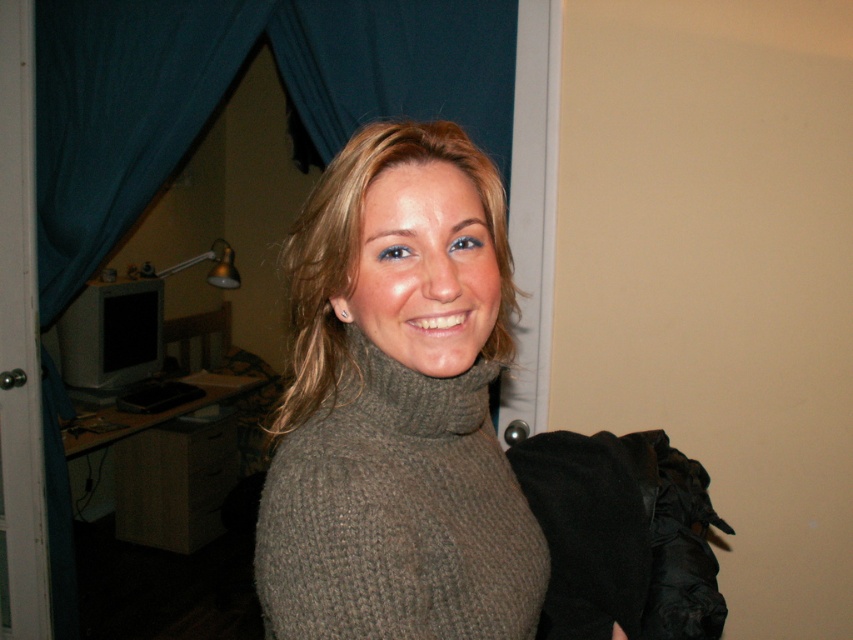
Question: Which object is the farthest from the blue fabric curtain at upper left?

Choices:
 (A) knit sweater at center
 (B) knitted gray polo neck at center

Answer: (B)

Question: Is knit sweater at center to the left of knitted gray polo neck at center from the viewer's perspective?

Choices:
 (A) yes
 (B) no

Answer: (A)

Question: Does blue fabric curtain at upper left appear on the right side of knitted gray polo neck at center?

Choices:
 (A) no
 (B) yes

Answer: (A)

Question: Does blue fabric curtain at upper left come in front of knitted gray polo neck at center?

Choices:
 (A) yes
 (B) no

Answer: (B)

Question: Which of these objects is positioned closest to the knitted gray polo neck at center?

Choices:
 (A) blue fabric curtain at upper left
 (B) knit sweater at center

Answer: (B)

Question: Which is nearer to the knit sweater at center?

Choices:
 (A) knitted gray polo neck at center
 (B) blue fabric curtain at upper left

Answer: (A)